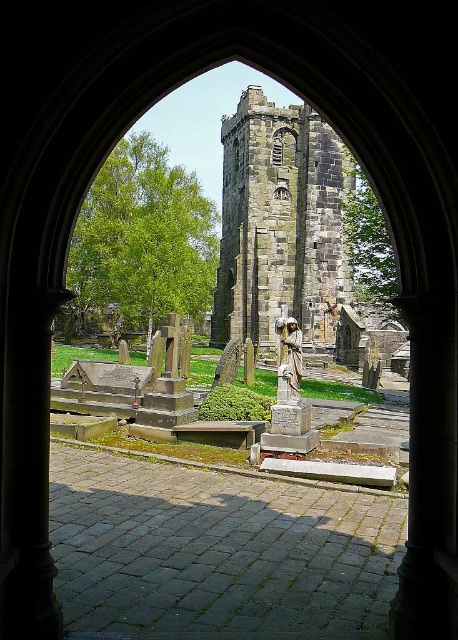
You are standing in the churchyard and want to take a photo that includes both the stone tower at center and the polished bronze statue at center. Which object should you position closer to the camera to ensure both are fully visible in the frame?

The stone tower at center is much taller than the polished bronze statue at center. To ensure both are fully visible in the frame, position the polished bronze statue at center closer to the camera so its height matches the stone tower at center in the photo.

In the scene shown: You are standing in front of the arched doorway and want to place a large decorative pot between the stone tower at center and the polished bronze statue at center. Based on their widths, will the pot fit between them?

The stone tower at center might be wider than polished bronze statue at center, so the pot may not fit between them if the combined width of both objects exceeds the available space. However, without exact measurements, it is uncertain.

You are an architect planning to place a new sculpture in the churchyard. The sculpture requires a base that can support up to 500 kg. Given the stone tower at center and the polished bronze statue at center, which object would be more suitable as a base for the sculpture?

The stone tower at center has a larger size compared to the polished bronze statue at center, making it more stable and capable of supporting the sculpture with a 500 kg base requirement.